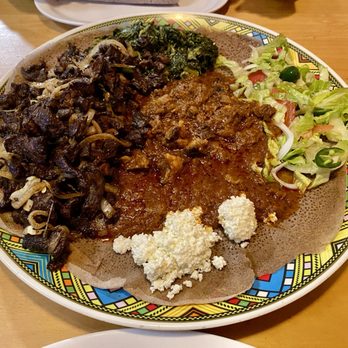
Locate an element on the screen. The image size is (348, 348). plate is located at coordinates (288, 279).